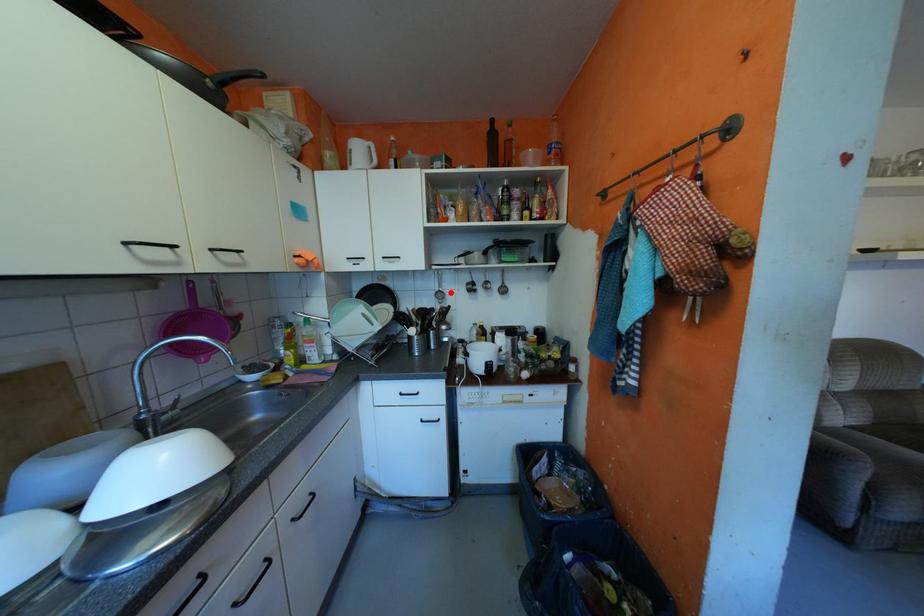
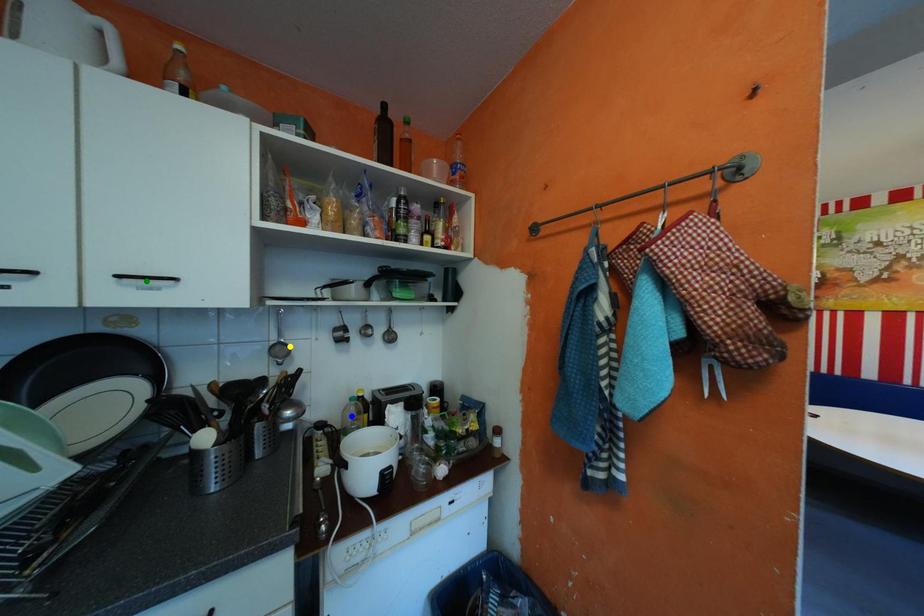
Question: I am providing you with two images of the same scene from different viewpoints. A red point is marked on the first image. You are given multiple points on the second image. Which point in image 2 represents the same 3d spot as the red point in image 1?

Choices:
 (A) yellow point
 (B) blue point
 (C) green point

Answer: (A)